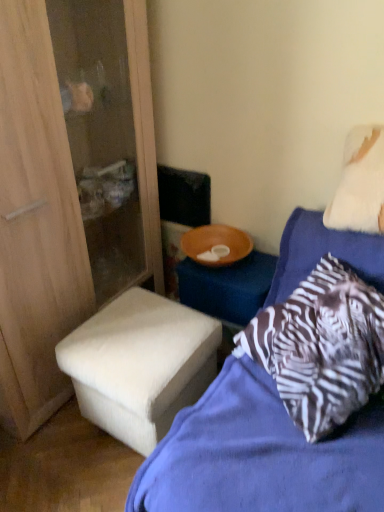
Question: Could you tell me if white fabric ottoman at lower left is turned towards white fabric stool at lower left?

Choices:
 (A) yes
 (B) no

Answer: (A)

Question: From a real-world perspective, is white fabric ottoman at lower left beneath white fabric stool at lower left?

Choices:
 (A) no
 (B) yes

Answer: (A)

Question: From the image's perspective, does white fabric ottoman at lower left appear higher than white fabric stool at lower left?

Choices:
 (A) yes
 (B) no

Answer: (A)

Question: Does white fabric ottoman at lower left lie behind white fabric stool at lower left?

Choices:
 (A) no
 (B) yes

Answer: (A)

Question: Can you confirm if white fabric ottoman at lower left is bigger than white fabric stool at lower left?

Choices:
 (A) yes
 (B) no

Answer: (A)

Question: From the image's perspective, is white fabric stool at lower left above or below white fluffy pillow at upper right?

Choices:
 (A) above
 (B) below

Answer: (B)

Question: Is point (201, 388) positioned closer to the camera than point (369, 173)?

Choices:
 (A) farther
 (B) closer

Answer: (A)

Question: Do you think white fabric stool at lower left is within white fluffy pillow at upper right, or outside of it?

Choices:
 (A) outside
 (B) inside

Answer: (A)

Question: Considering the relative positions of white fabric stool at lower left and white fluffy pillow at upper right in the image provided, is white fabric stool at lower left to the left or to the right of white fluffy pillow at upper right?

Choices:
 (A) left
 (B) right

Answer: (A)

Question: In the image, is zebra-patterned pillow at upper right on the left side or the right side of white fluffy pillow at upper right?

Choices:
 (A) right
 (B) left

Answer: (B)

Question: Considering their positions, is zebra-patterned pillow at upper right located in front of or behind white fluffy pillow at upper right?

Choices:
 (A) behind
 (B) front

Answer: (B)

Question: Is zebra-patterned pillow at upper right taller or shorter than white fluffy pillow at upper right?

Choices:
 (A) short
 (B) tall

Answer: (B)

Question: Considering the positions of zebra-patterned pillow at upper right and white fluffy pillow at upper right in the image, is zebra-patterned pillow at upper right wider or thinner than white fluffy pillow at upper right?

Choices:
 (A) wide
 (B) thin

Answer: (A)

Question: In terms of height, does zebra-patterned pillow at upper right look taller or shorter compared to white fabric ottoman at lower left?

Choices:
 (A) tall
 (B) short

Answer: (B)

Question: Considering the relative positions of zebra-patterned pillow at upper right and white fabric ottoman at lower left in the image provided, is zebra-patterned pillow at upper right to the left or to the right of white fabric ottoman at lower left?

Choices:
 (A) right
 (B) left

Answer: (A)